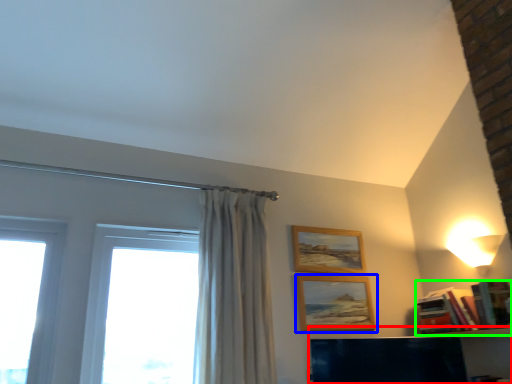
Question: Considering the real-world distances, which object is farthest from shelf (highlighted by a red box)? picture frame (highlighted by a blue box) or book (highlighted by a green box)?

Choices:
 (A) picture frame
 (B) book

Answer: (A)